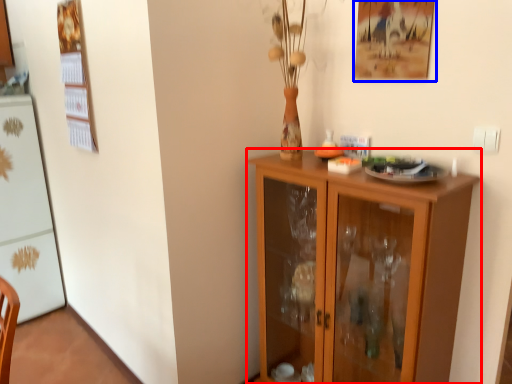
Question: Among these objects, which one is nearest to the camera, cupboard (highlighted by a red box) or picture frame (highlighted by a blue box)?

Choices:
 (A) cupboard
 (B) picture frame

Answer: (A)